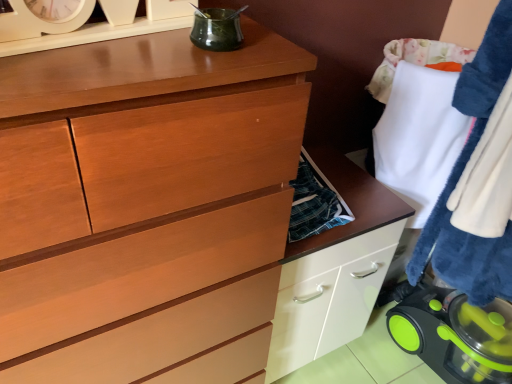
Question: Is green plastic vacuum cleaner at lower right, which is the second appliance in top-to-bottom order, closer to the viewer compared to white fluffy towel at right?

Choices:
 (A) no
 (B) yes

Answer: (A)

Question: Does green plastic vacuum cleaner at lower right, which is the 1th appliance from back to front, appear on the right side of white fluffy towel at right?

Choices:
 (A) no
 (B) yes

Answer: (A)

Question: Can you confirm if green plastic vacuum cleaner at lower right, arranged as the 1th appliance when viewed from the right, is thinner than white fluffy towel at right?

Choices:
 (A) yes
 (B) no

Answer: (A)

Question: Does green plastic vacuum cleaner at lower right, which is the 1th appliance from back to front, have a larger size compared to white fluffy towel at right?

Choices:
 (A) yes
 (B) no

Answer: (B)

Question: Are green plastic vacuum cleaner at lower right, arranged as the 1th appliance when viewed from the right, and white fluffy towel at right far apart?

Choices:
 (A) no
 (B) yes

Answer: (A)

Question: From the image's perspective, is green plastic vacuum cleaner at lower right, arranged as the 1th appliance when viewed from the right, positioned above or below white fluffy towel at right?

Choices:
 (A) above
 (B) below

Answer: (B)

Question: From a real-world perspective, relative to white fluffy towel at right, is green plastic vacuum cleaner at lower right, which is the 1th appliance from back to front, vertically above or below?

Choices:
 (A) above
 (B) below

Answer: (B)

Question: Based on their sizes in the image, would you say green plastic vacuum cleaner at lower right, which is the 2th appliance from front to back, is bigger or smaller than white fluffy towel at right?

Choices:
 (A) small
 (B) big

Answer: (A)

Question: In the image, is green plastic vacuum cleaner at lower right, placed as the first appliance when sorted from bottom to top, positioned in front of or behind white fluffy towel at right?

Choices:
 (A) front
 (B) behind

Answer: (B)

Question: Considering the positions of point (437, 294) and point (236, 14), is point (437, 294) closer or farther from the camera than point (236, 14)?

Choices:
 (A) closer
 (B) farther

Answer: (B)

Question: Visually, is green plastic vacuum cleaner at lower right, arranged as the 1th appliance when viewed from the right, positioned to the left or to the right of green glass jar at upper center, the second appliance viewed from the back?

Choices:
 (A) left
 (B) right

Answer: (B)

Question: In terms of size, does green plastic vacuum cleaner at lower right, which is the 1th appliance from back to front, appear bigger or smaller than green glass jar at upper center, positioned as the 1th appliance in left-to-right order?

Choices:
 (A) small
 (B) big

Answer: (B)

Question: Is green plastic vacuum cleaner at lower right, placed as the first appliance when sorted from bottom to top, wider or thinner than green glass jar at upper center, the second appliance viewed from the back?

Choices:
 (A) wide
 (B) thin

Answer: (A)

Question: Is green glass jar at upper center, positioned as the 1th appliance in left-to-right order, in front of or behind green plastic vacuum cleaner at lower right, which is the 1th appliance from back to front, in the image?

Choices:
 (A) front
 (B) behind

Answer: (A)

Question: Is green glass jar at upper center, positioned as the 1th appliance in left-to-right order, wider or thinner than green plastic vacuum cleaner at lower right, which is the 2th appliance from front to back?

Choices:
 (A) thin
 (B) wide

Answer: (A)